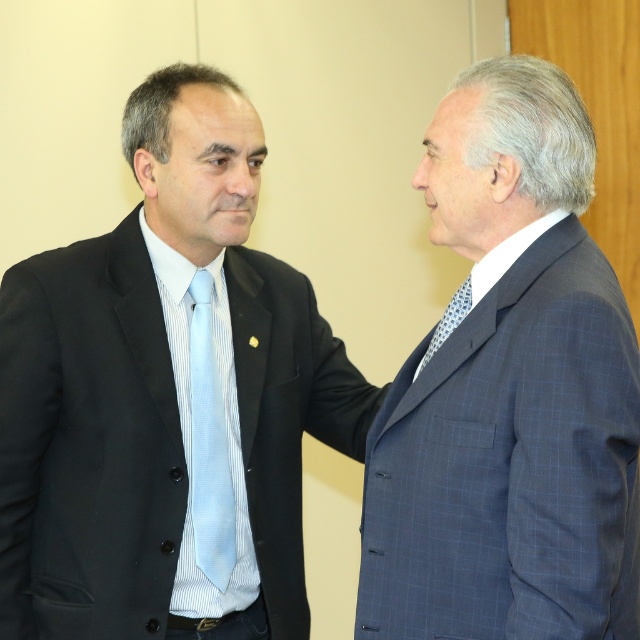
Question: Where is blue checkered suit at right located in relation to light blue silk tie at left in the image?

Choices:
 (A) below
 (B) above

Answer: (B)

Question: Which point is closer to the camera?

Choices:
 (A) blue dotted tie at right
 (B) blue checkered suit at right
 (C) light blue silk tie at left

Answer: (B)

Question: Which object appears closest to the camera in this image?

Choices:
 (A) light blue silk tie at left
 (B) blue dotted tie at right
 (C) matte black suit at left

Answer: (B)

Question: Can you confirm if matte black suit at left is positioned above blue checkered suit at right?

Choices:
 (A) yes
 (B) no

Answer: (B)

Question: Which object is positioned farthest from the blue checkered suit at right?

Choices:
 (A) matte black suit at left
 (B) light blue silk tie at left
 (C) blue dotted tie at right

Answer: (B)

Question: Is matte black suit at left smaller than blue dotted tie at right?

Choices:
 (A) no
 (B) yes

Answer: (A)